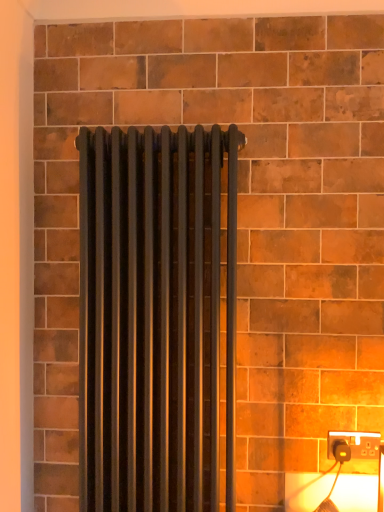
Question: Should I look upward or downward to see matte black radiator at center?

Choices:
 (A) down
 (B) up

Answer: (A)

Question: From a real-world perspective, is matte black radiator at center under black plastic power plug at lower right?

Choices:
 (A) yes
 (B) no

Answer: (B)

Question: Is matte black radiator at center further to the viewer compared to black plastic power plug at lower right?

Choices:
 (A) no
 (B) yes

Answer: (A)

Question: From the image's perspective, is matte black radiator at center below black plastic power plug at lower right?

Choices:
 (A) yes
 (B) no

Answer: (B)

Question: Is matte black radiator at center directly adjacent to black plastic power plug at lower right?

Choices:
 (A) yes
 (B) no

Answer: (B)

Question: From a real-world perspective, is matte black radiator at center over black plastic power plug at lower right?

Choices:
 (A) no
 (B) yes

Answer: (B)

Question: From the image's perspective, would you say matte black radiator at center is positioned over black plastic power plug at lower right?

Choices:
 (A) yes
 (B) no

Answer: (A)

Question: From a real-world perspective, is black plastic power plug at lower right under matte black radiator at center?

Choices:
 (A) yes
 (B) no

Answer: (A)

Question: Considering the relative sizes of black plastic power plug at lower right and matte black radiator at center in the image provided, is black plastic power plug at lower right thinner than matte black radiator at center?

Choices:
 (A) yes
 (B) no

Answer: (A)

Question: Is black plastic power plug at lower right not inside matte black radiator at center?

Choices:
 (A) yes
 (B) no

Answer: (A)

Question: Could you tell me if black plastic power plug at lower right is turned towards matte black radiator at center?

Choices:
 (A) yes
 (B) no

Answer: (B)

Question: Is black plastic power plug at lower right facing away from matte black radiator at center?

Choices:
 (A) yes
 (B) no

Answer: (B)

Question: Considering the relative sizes of black plastic power plug at lower right and matte black radiator at center in the image provided, is black plastic power plug at lower right taller than matte black radiator at center?

Choices:
 (A) no
 (B) yes

Answer: (A)

Question: In terms of size, does black plastic power plug at lower right appear bigger or smaller than matte black radiator at center?

Choices:
 (A) big
 (B) small

Answer: (B)